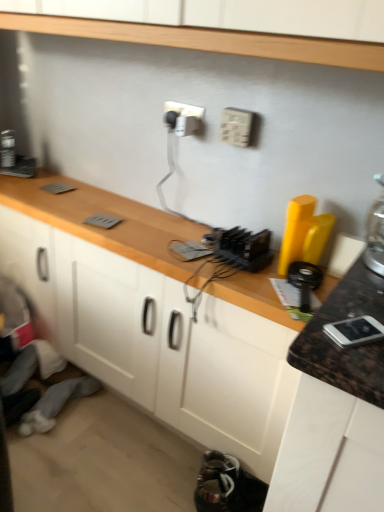
Question: From a real-world perspective, is matte gray cabinet at lower left located beneath wooden at center?

Choices:
 (A) yes
 (B) no

Answer: (A)

Question: Is matte gray cabinet at lower left positioned before wooden at center?

Choices:
 (A) no
 (B) yes

Answer: (A)

Question: Is matte gray cabinet at lower left wider than wooden at center?

Choices:
 (A) no
 (B) yes

Answer: (B)

Question: Considering the relative sizes of matte gray cabinet at lower left and wooden at center in the image provided, is matte gray cabinet at lower left bigger than wooden at center?

Choices:
 (A) no
 (B) yes

Answer: (A)

Question: From a real-world perspective, is matte gray cabinet at lower left located higher than wooden at center?

Choices:
 (A) no
 (B) yes

Answer: (A)

Question: Does matte gray cabinet at lower left have a lesser height compared to wooden at center?

Choices:
 (A) yes
 (B) no

Answer: (A)

Question: Is white plastic electric outlet at upper center, the 1th electric outlet viewed from the back, aimed at matte gray cabinet at lower left?

Choices:
 (A) no
 (B) yes

Answer: (A)

Question: Considering the relative sizes of white plastic electric outlet at upper center, the second electric outlet from the front, and matte gray cabinet at lower left in the image provided, is white plastic electric outlet at upper center, the second electric outlet from the front, thinner than matte gray cabinet at lower left?

Choices:
 (A) yes
 (B) no

Answer: (A)

Question: Is white plastic electric outlet at upper center, the 1th electric outlet viewed from the back, smaller than matte gray cabinet at lower left?

Choices:
 (A) yes
 (B) no

Answer: (A)

Question: Does white plastic electric outlet at upper center, the 1th electric outlet when ordered from left to right, have a greater width compared to matte gray cabinet at lower left?

Choices:
 (A) no
 (B) yes

Answer: (A)

Question: Is the position of white plastic electric outlet at upper center, the 1th electric outlet when ordered from left to right, less distant than that of matte gray cabinet at lower left?

Choices:
 (A) no
 (B) yes

Answer: (B)

Question: Is white plastic electric outlet at upper center, the 1th electric outlet viewed from the back, bigger than matte gray cabinet at lower left?

Choices:
 (A) no
 (B) yes

Answer: (A)

Question: Is white plastic electric outlet at upper center, the second electric outlet from the left, next to multicolored fabric shoes at lower center?

Choices:
 (A) yes
 (B) no

Answer: (B)